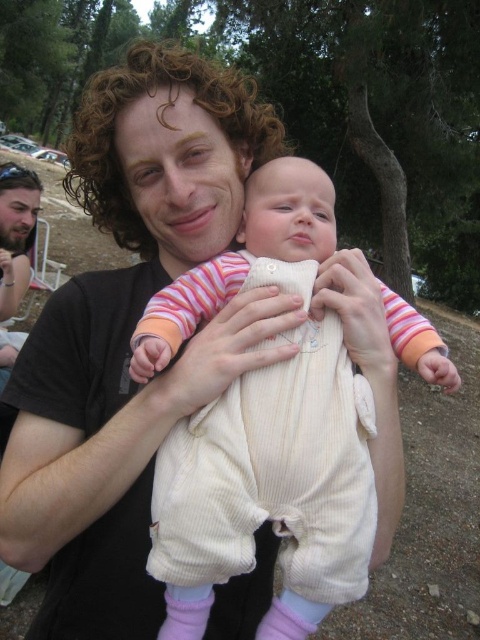
Measure the distance from white corduroy onesie at center to cream corduroy baby at center.

The distance of white corduroy onesie at center from cream corduroy baby at center is 4.78 inches.

Can you confirm if white corduroy onesie at center is positioned to the right of cream corduroy baby at center?

Correct, you'll find white corduroy onesie at center to the right of cream corduroy baby at center.

Is point (315, 512) closer to viewer compared to point (276, 324)?

Yes.

At what (x,y) coordinates should I click in order to perform the action: click on white corduroy onesie at center. Please return your answer as a coordinate pair (x, y). The height and width of the screenshot is (640, 480). Looking at the image, I should click on (269, 490).